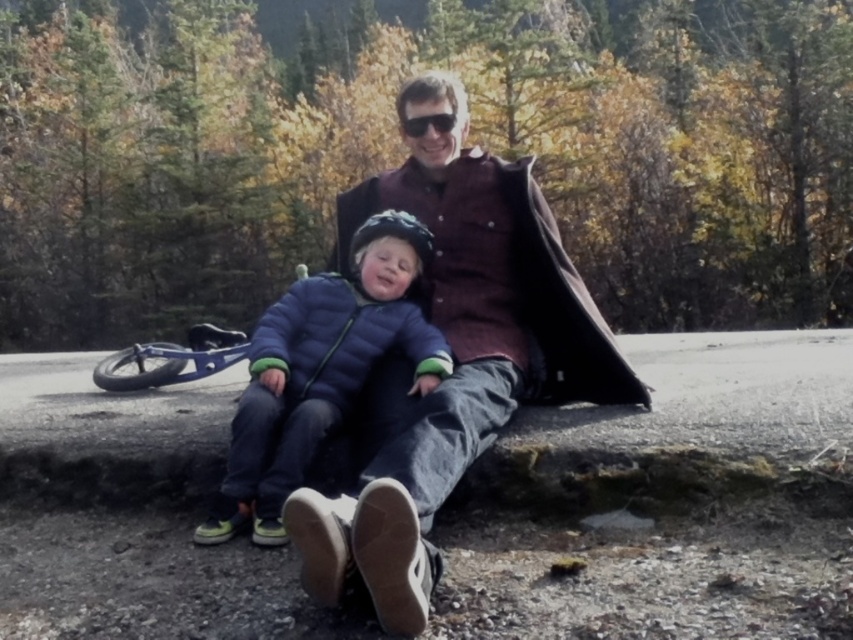
You are a photographer trying to capture a closeup of the blue puffy jacket at center and the shiny black sunglasses at center. Since you want both items to appear equally large in the photo, which object should you move closer to the camera and which should you move farther away?

Result: The blue puffy jacket at center is wider than the shiny black sunglasses at center. To make them appear the same size in the photo, move the narrower shiny black sunglasses at center closer to the camera and move the wider blue puffy jacket at center farther away.